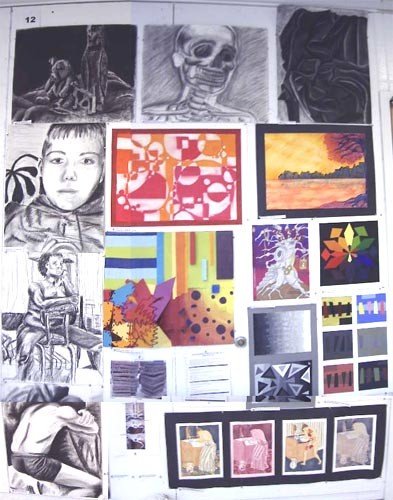
This screenshot has width=393, height=500. I want to click on dresser, so click(x=189, y=453), click(x=240, y=454), click(x=294, y=451), click(x=343, y=443).